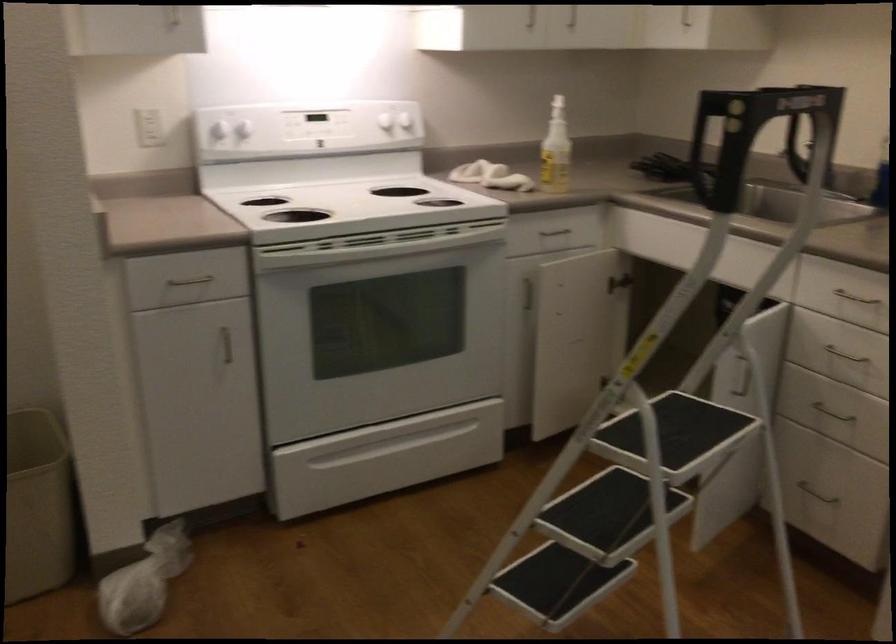
Where is `oven drawer handle`? oven drawer handle is located at coordinates (416, 433).